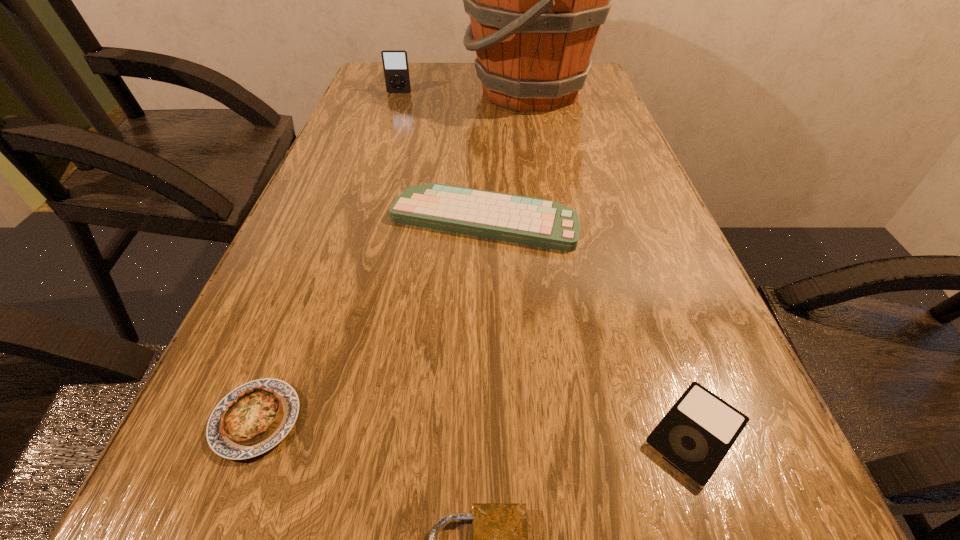
Find the location of a particular element. The image size is (960, 540). object that is at the far right corner is located at coordinates (536, 0).

What are the coordinates of `vacant space at the far edge` in the screenshot? It's located at (411, 87).

Locate an element on the screen. This screenshot has height=540, width=960. free space at the left edge is located at coordinates (371, 118).

Image resolution: width=960 pixels, height=540 pixels. I want to click on vacant space at the right edge, so click(x=581, y=192).

Locate an element on the screen. vacant space that's between the fourth shortest object and the bucket is located at coordinates (507, 156).

The width and height of the screenshot is (960, 540). Identify the location of vacant region between the farther iPod and the nearer iPod. (547, 263).

The height and width of the screenshot is (540, 960). What are the coordinates of `free space between the quiche and the computer keyboard` in the screenshot? It's located at (370, 320).

You are a GUI agent. You are given a task and a screenshot of the screen. Output one action in this format:
    pyautogui.click(x=<x>, y=<y>)
    Task: Click on the vacant point located between the right iPod and the third farthest object
    
    Given the screenshot: What is the action you would take?
    pyautogui.click(x=589, y=327)

I want to click on free space between the left iPod and the computer keyboard, so click(x=441, y=156).

The image size is (960, 540). In order to click on blank region between the shortest object and the computer keyboard in this screenshot , I will do `click(589, 327)`.